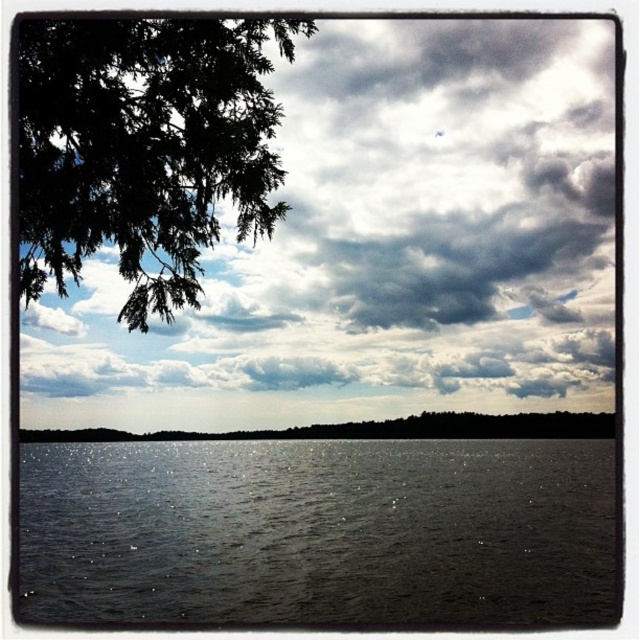
Question: Which object is positioned farthest from the cloudy sky at upper center?

Choices:
 (A) glistening dark water at center
 (B) dark green leafy tree at lower center

Answer: (A)

Question: Where is green leafy branch at upper left located in relation to dark green leafy tree at lower center in the image?

Choices:
 (A) below
 (B) above

Answer: (B)

Question: Which of these objects is positioned farthest from the glistening dark water at center?

Choices:
 (A) dark green leafy tree at lower center
 (B) cloudy sky at upper center
 (C) green leafy branch at upper left

Answer: (C)

Question: Which of the following is the closest to the observer?

Choices:
 (A) glistening dark water at center
 (B) dark green leafy tree at lower center
 (C) green leafy branch at upper left

Answer: (C)

Question: Is cloudy sky at upper center to the right of dark green leafy tree at lower center from the viewer's perspective?

Choices:
 (A) no
 (B) yes

Answer: (B)

Question: Does cloudy sky at upper center appear over green leafy branch at upper left?

Choices:
 (A) yes
 (B) no

Answer: (A)